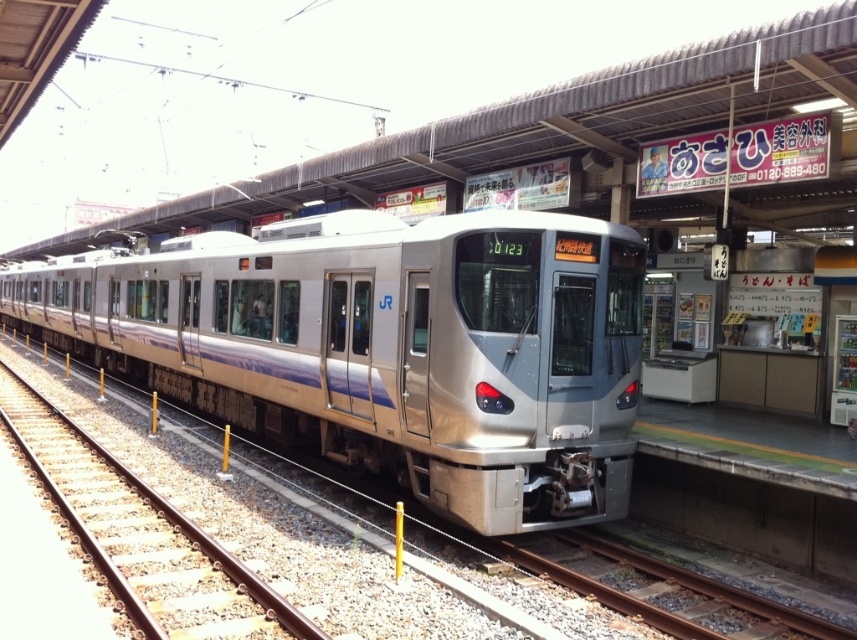
Question: Which point is closer to the camera?

Choices:
 (A) (423, 326)
 (B) (650, 556)

Answer: (A)

Question: Does silver metallic train at center have a larger size compared to rusty metal train track at lower center?

Choices:
 (A) yes
 (B) no

Answer: (A)

Question: Does silver metallic train at center have a greater width compared to rusty metal train track at lower center?

Choices:
 (A) no
 (B) yes

Answer: (B)

Question: Does silver metallic train at center lie behind rusty metal train track at lower center?

Choices:
 (A) no
 (B) yes

Answer: (B)